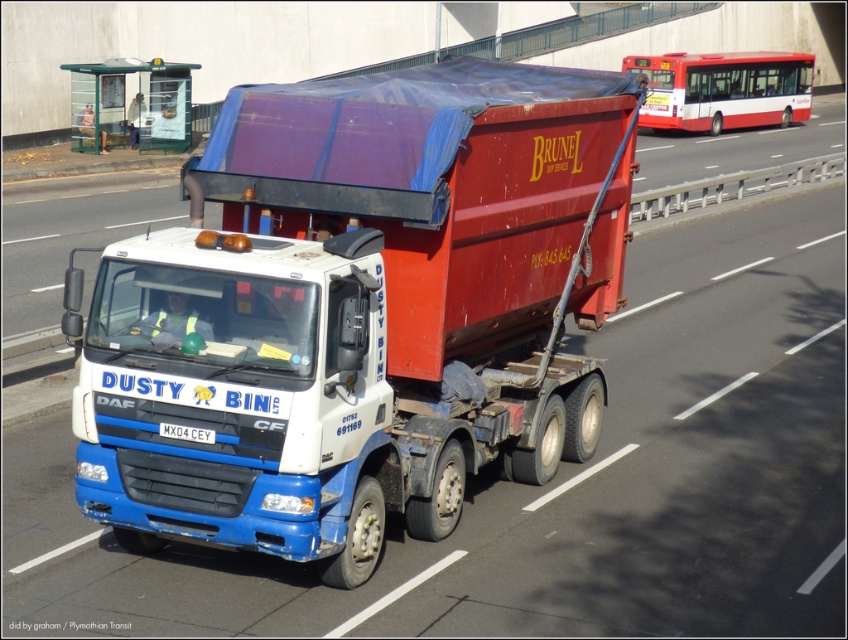
You are a delivery driver who needs to identify the vehicle registration details. From your current position, can you see the white plastic license plate at center while looking at the matte white truck at center?

The matte white truck at center is located above the white plastic license plate at center, so yes, you can see the white plastic license plate at center while looking at the matte white truck at center because it is positioned below it.